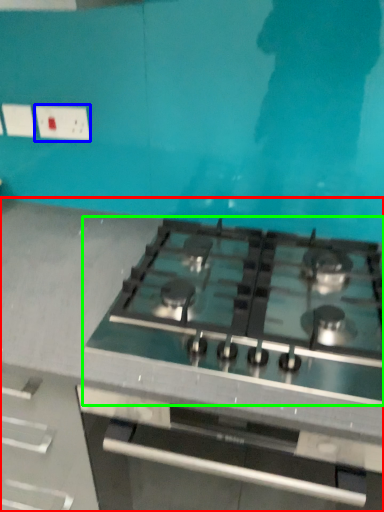
Question: Considering the real-world distances, which object is closest to countertop (highlighted by a red box)? electric outlet (highlighted by a blue box) or gas stove (highlighted by a green box).

Choices:
 (A) electric outlet
 (B) gas stove

Answer: (B)